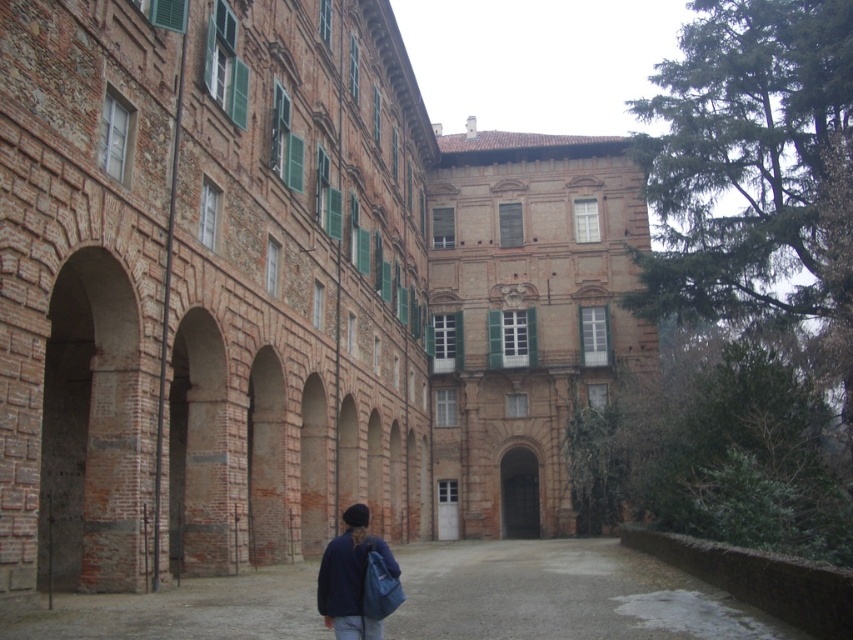
Does smooth brick courtyard at center have a greater height compared to dark blue fabric jacket at lower center?

No, smooth brick courtyard at center is not taller than dark blue fabric jacket at lower center.

Between point (521, 573) and point (335, 637), which one is positioned behind?

The point (521, 573) is more distant.

Where is `smooth brick courtyard at center`? smooth brick courtyard at center is located at coordinates (561, 595).